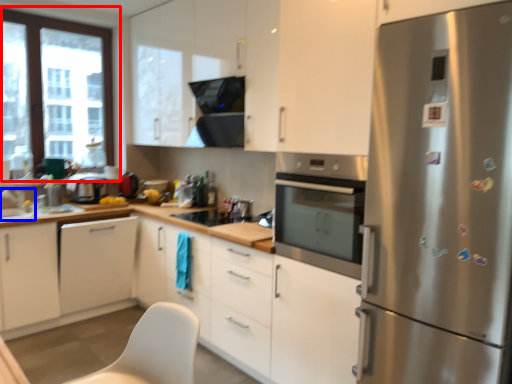
Question: Which of the following is the closest to the observer, window (highlighted by a red box) or sink (highlighted by a blue box)?

Choices:
 (A) window
 (B) sink

Answer: (B)